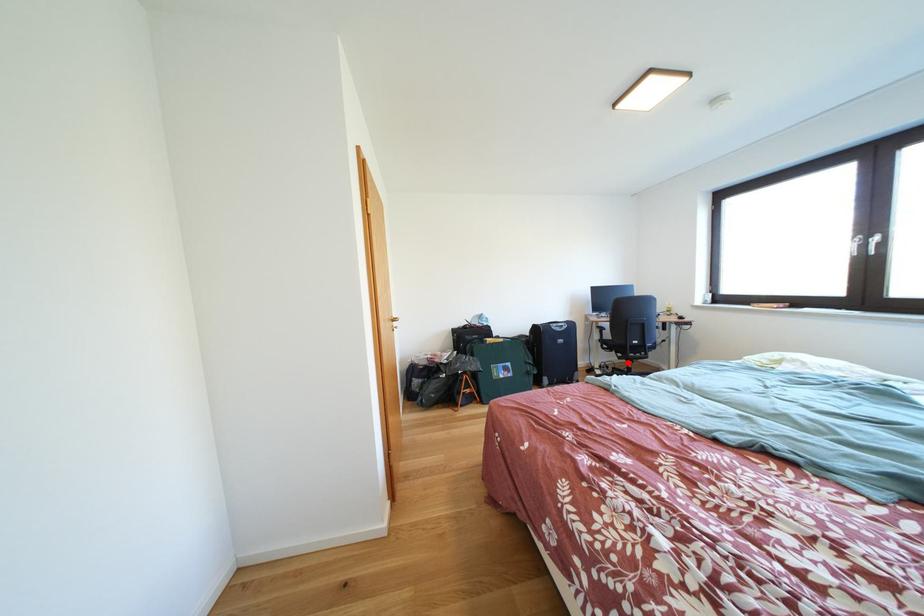
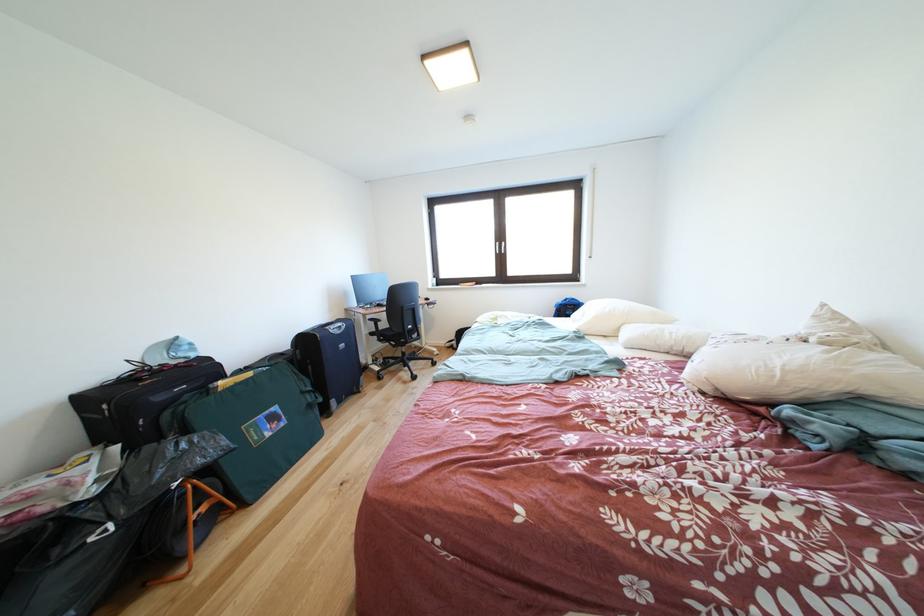
Find the pixel in the second image that matches the highlighted location in the first image.

(403, 351)